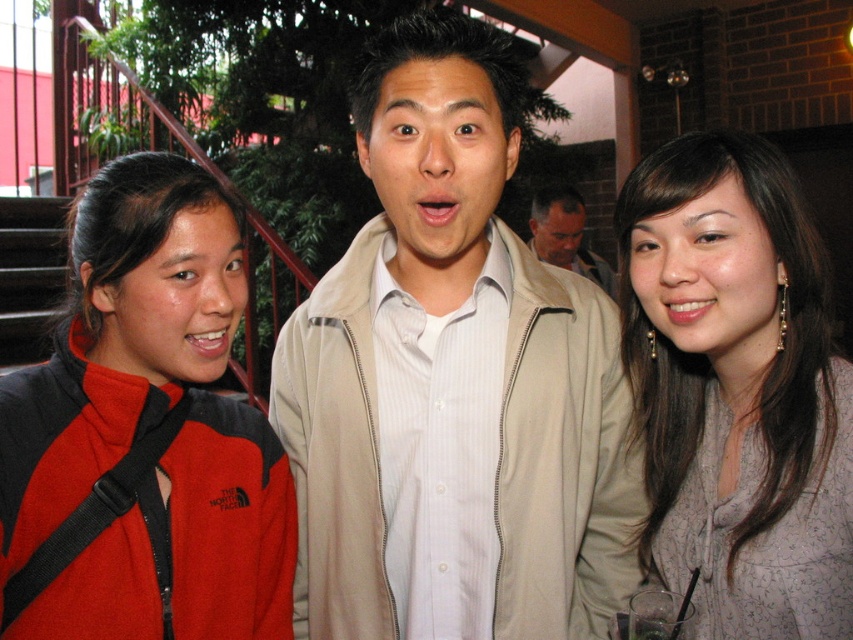
You are a photographer adjusting your camera settings. You notice the beige fabric jacket at center and the matte gray blouse at center in your frame. Which one is positioned to the left?

The beige fabric jacket at center is to the left of the matte gray blouse at center, so it is positioned to the left.

You are trying to decide which jacket is taller between the beige fabric jacket at center and the red fleece jacket at left. Based on the scene, which one is taller?

The beige fabric jacket at center is taller than the red fleece jacket at left.

You are a photographer adjusting the camera focus. The matte gray blouse at center and the light beige jacket at center are both in the frame. Which one should you adjust the focus on first if you want to ensure the wider object is in focus first?

The light beige jacket at center is wider than the matte gray blouse at center, so you should adjust the focus on the light beige jacket at center first.